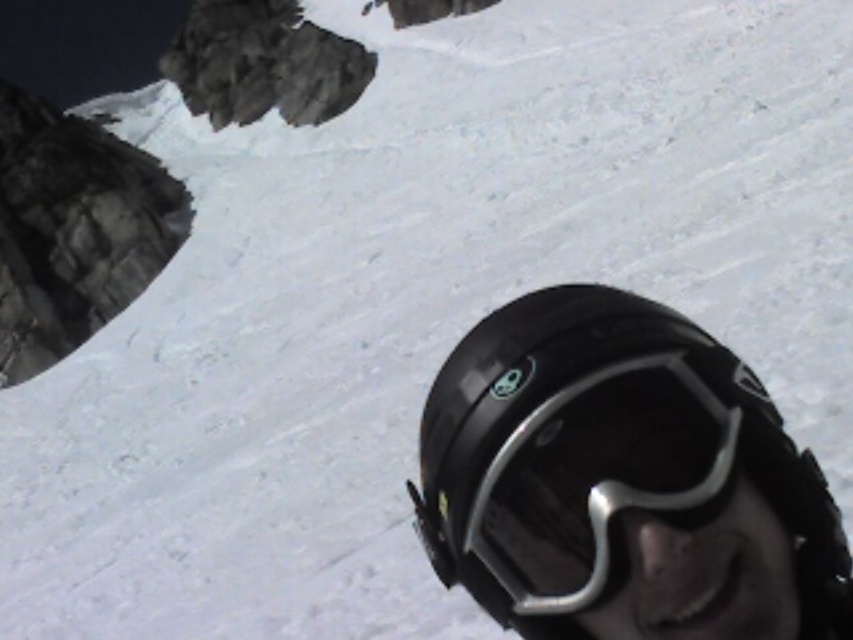
Question: Which point is farther to the camera?

Choices:
 (A) black matte helmet at lower right
 (B) black matte goggles at lower right

Answer: (B)

Question: Can you confirm if black matte helmet at lower right is positioned above black matte goggles at lower right?

Choices:
 (A) no
 (B) yes

Answer: (B)

Question: Does black matte helmet at lower right have a larger size compared to black matte goggles at lower right?

Choices:
 (A) no
 (B) yes

Answer: (B)

Question: Among these points, which one is nearest to the camera?

Choices:
 (A) (737, 435)
 (B) (566, 349)

Answer: (A)

Question: Is black matte helmet at lower right thinner than black matte goggles at lower right?

Choices:
 (A) no
 (B) yes

Answer: (A)